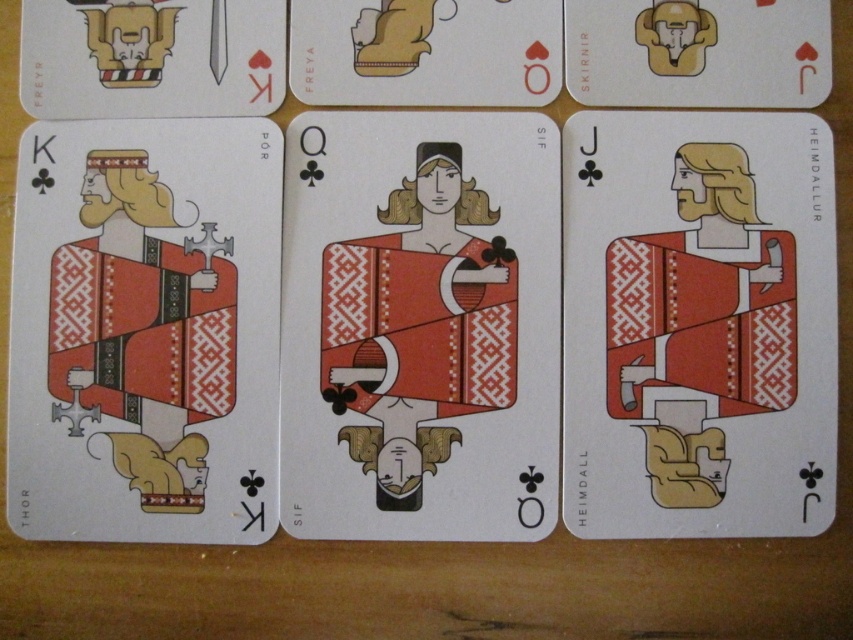
Question: Which is nearer to the matte red dress at center?

Choices:
 (A) matte gold sword at upper left
 (B) matte red fabric king at left

Answer: (B)

Question: Is matte red card at right above matte red fabric king at left?

Choices:
 (A) no
 (B) yes

Answer: (B)

Question: Is matte red dress at center below matte gold sword at upper left?

Choices:
 (A) no
 (B) yes

Answer: (B)

Question: Which point is closer to the camera?

Choices:
 (A) matte red card at right
 (B) matte red fabric king at left
 (C) matte gold sword at upper left
 (D) matte red dress at center

Answer: (B)

Question: Observing the image, what is the correct spatial positioning of matte red dress at center in reference to matte gold sword at upper left?

Choices:
 (A) right
 (B) left

Answer: (A)

Question: Which of the following is the closest to the observer?

Choices:
 (A) matte red card at right
 (B) matte gold sword at upper left
 (C) matte red dress at center

Answer: (C)